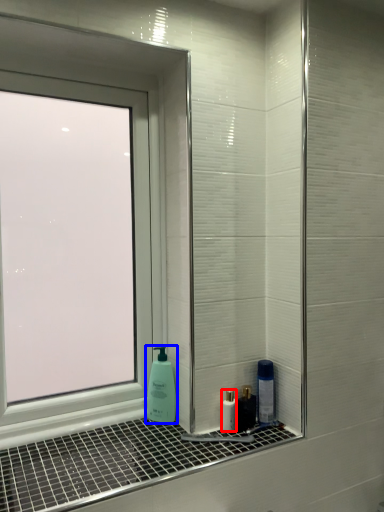
Question: Among these objects, which one is farthest to the camera, mouthwash (highlighted by a red box) or soap dispenser (highlighted by a blue box)?

Choices:
 (A) mouthwash
 (B) soap dispenser

Answer: (B)